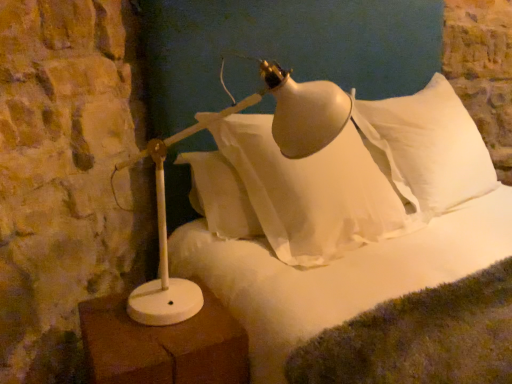
Question: From the image's perspective, is white matte table lamp at lower left beneath white matte lamp at left?

Choices:
 (A) no
 (B) yes

Answer: (B)

Question: Would you say white matte lamp at left is part of white matte table lamp at lower left's contents?

Choices:
 (A) yes
 (B) no

Answer: (B)

Question: Can you confirm if white matte table lamp at lower left is positioned to the left of white matte lamp at left?

Choices:
 (A) yes
 (B) no

Answer: (A)

Question: From a real-world perspective, is white matte table lamp at lower left over white matte lamp at left?

Choices:
 (A) yes
 (B) no

Answer: (B)

Question: Is white matte table lamp at lower left wider than white matte lamp at left?

Choices:
 (A) yes
 (B) no

Answer: (B)

Question: Is white matte table lamp at lower left directly adjacent to white matte lamp at left?

Choices:
 (A) yes
 (B) no

Answer: (B)

Question: Is white soft pillow at upper right facing towards white fluffy bed at center?

Choices:
 (A) yes
 (B) no

Answer: (B)

Question: From a real-world perspective, is white soft pillow at upper right physically below white fluffy bed at center?

Choices:
 (A) no
 (B) yes

Answer: (B)

Question: Is white soft pillow at upper right not near white fluffy bed at center?

Choices:
 (A) yes
 (B) no

Answer: (B)

Question: Is white soft pillow at upper right facing away from white fluffy bed at center?

Choices:
 (A) no
 (B) yes

Answer: (A)

Question: Does white soft pillow at upper right have a lesser width compared to white fluffy bed at center?

Choices:
 (A) no
 (B) yes

Answer: (B)

Question: Is white soft pillow at upper right beside white fluffy bed at center?

Choices:
 (A) no
 (B) yes

Answer: (A)

Question: Is white matte lamp at left completely or partially outside of white soft pillow at upper right?

Choices:
 (A) no
 (B) yes

Answer: (B)